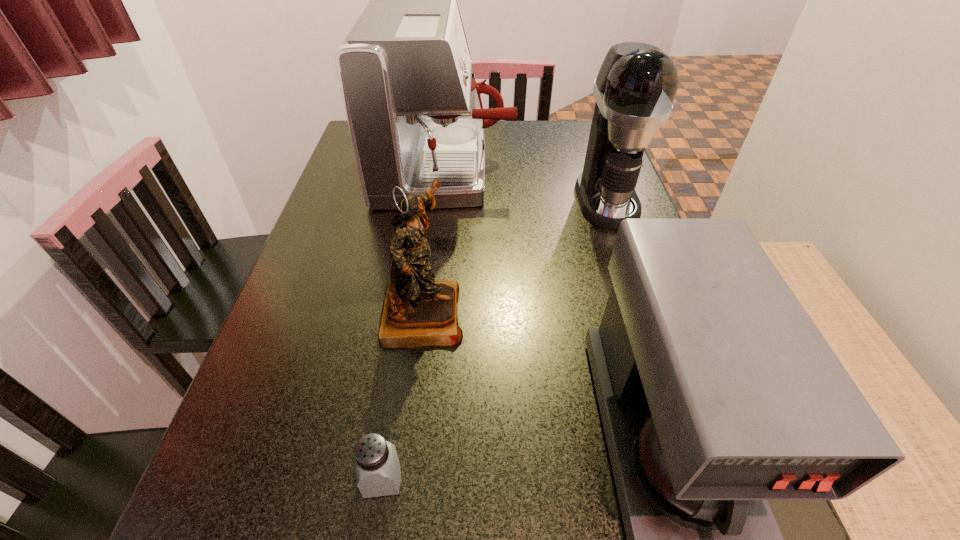
Locate an element on the screen. The image size is (960, 540). the leftmost coffee maker is located at coordinates (415, 114).

The image size is (960, 540). Identify the location of figurine. (417, 311).

The width and height of the screenshot is (960, 540). What are the coordinates of `saltshaker` in the screenshot? It's located at (377, 470).

The image size is (960, 540). What are the coordinates of `free space located 0.050m on the front of the leftmost coffee maker near the spout` in the screenshot? It's located at (530, 171).

Where is `vacant space located 0.210m on the front-facing side of the figurine`? vacant space located 0.210m on the front-facing side of the figurine is located at coordinates (572, 311).

Find the location of a particular element. vacant space positioned on the back of the shortest object is located at coordinates (409, 304).

This screenshot has height=540, width=960. What are the coordinates of `object located at the far edge` in the screenshot? It's located at (415, 114).

The image size is (960, 540). Identify the location of object that is at the left edge. (415, 114).

Where is `object located at the right edge`? The image size is (960, 540). object located at the right edge is located at coordinates (635, 88).

You are a GUI agent. You are given a task and a screenshot of the screen. Output one action in this format:
    pyautogui.click(x=<x>, y=<y>)
    Task: Click on the object that is positioned at the far left corner
    
    Given the screenshot: What is the action you would take?
    pyautogui.click(x=415, y=114)